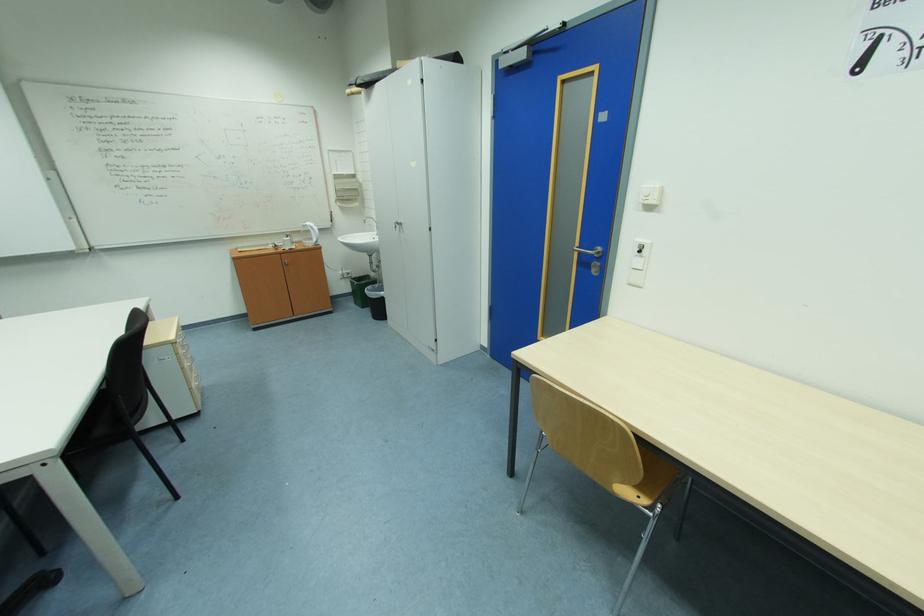
Find where to lift the kettle handle. Please return your answer as a coordinate pair (x, y).

(310, 230)